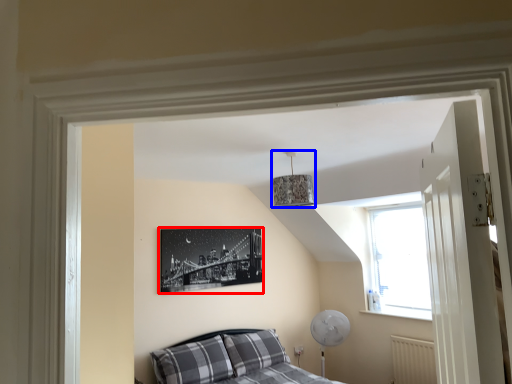
Question: Which object is further to the camera taking this photo, picture frame (highlighted by a red box) or lamp (highlighted by a blue box)?

Choices:
 (A) picture frame
 (B) lamp

Answer: (A)